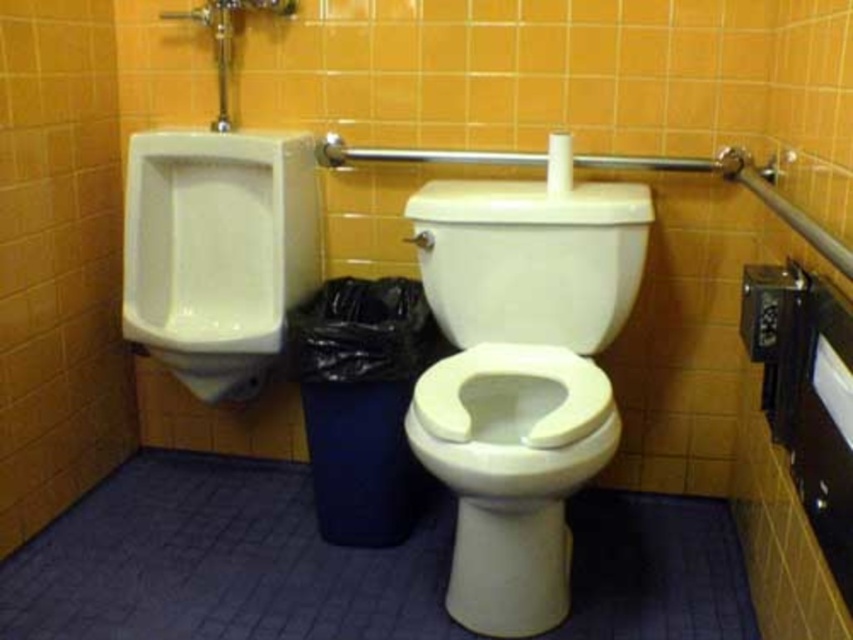
You are a maintenance worker inspecting the restroom. You notice the white glossy toilet bowl at center and the white glossy toilet lid at center. Which one is closer to you?

The white glossy toilet bowl at center is closer to you because it is in front of the white glossy toilet lid at center.